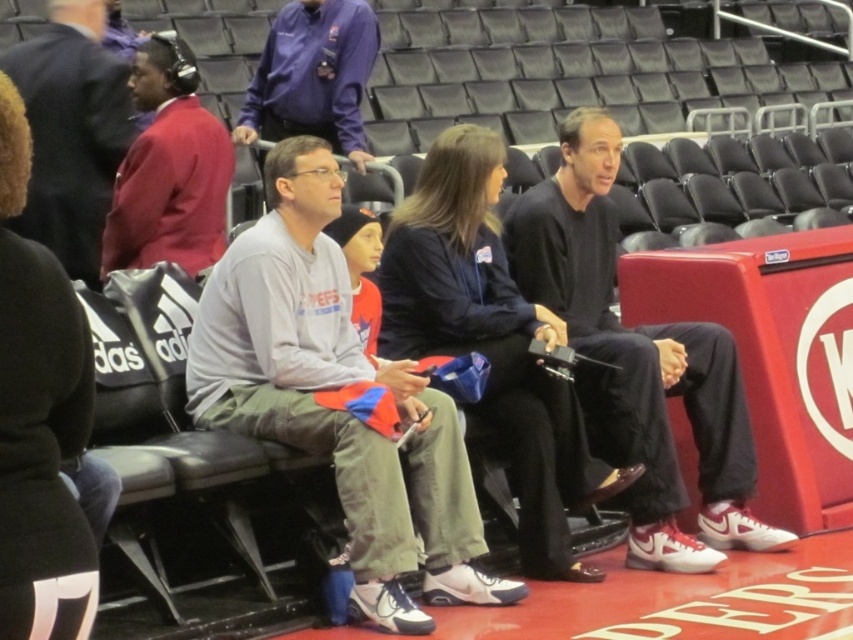
Looking at this image, where is the gray fleece sweatshirt at center located in the image?

The gray fleece sweatshirt at center is located at point (335, 388) in the image.

You are a photographer trying to capture a clear photo of both the black matte pants at center and the dark gray sweatshirt at center. Since you want to ensure both are fully visible, which object should you focus on first considering their sizes?

The black matte pants at center has a larger width than the dark gray sweatshirt at center, so you should focus on the black matte pants at center first to ensure it fits within the frame before adjusting for the smaller dark gray sweatshirt at center.

You are a photographer positioned at the front of the arena. You need to capture a closeup shot of both the black matte pants at center and the purple smooth shirt at upper center. Based on their sizes, which object should you focus on first to ensure it fits within your camera frame?

The black matte pants at center has a larger width than the purple smooth shirt at upper center, so you should focus on the black matte pants at center first to ensure it fits within the camera frame before adjusting for the smaller one.